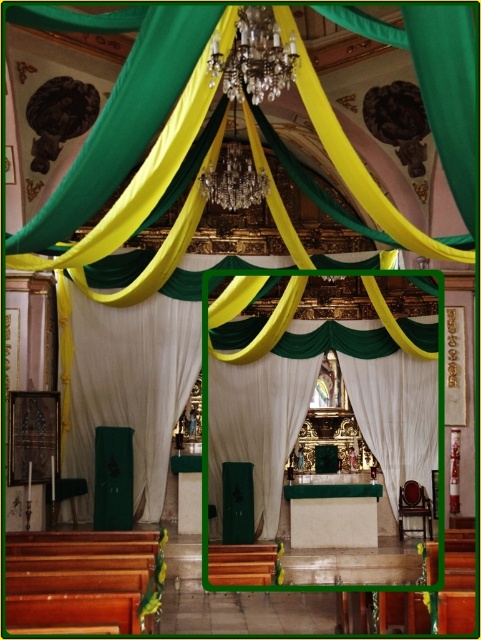
You are an event planner setting up the church for a wedding. You need to decide which curtain to use for the altar. The white sheer curtain at center and the white satin curtain at center are both options. Based on their widths, which one would you choose if you want the wider option?

The white sheer curtain at center is wider than the white satin curtain at center, so you should choose the white sheer curtain at center for the altar if you want the wider option.

You are an interior designer planning to replace the white sheer curtain at center and the white satin curtain at center with new ones. You need to ensure that the new curtains match the existing size requirements. Which curtain should you prioritize replacing first based on their size?

The white sheer curtain at center is larger in size than the white satin curtain at center, so you should prioritize replacing the white sheer curtain at center first to ensure the larger one is properly sized before addressing the smaller one.